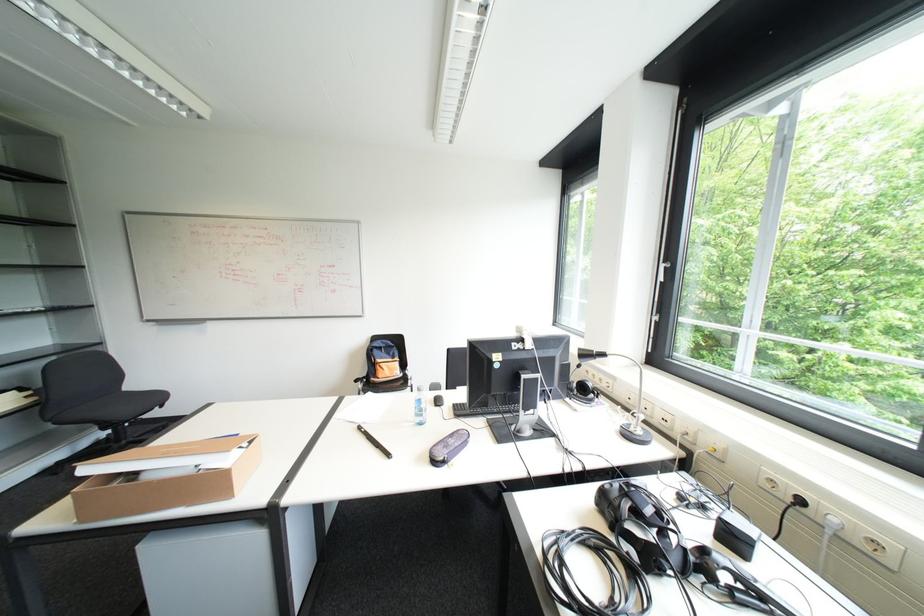
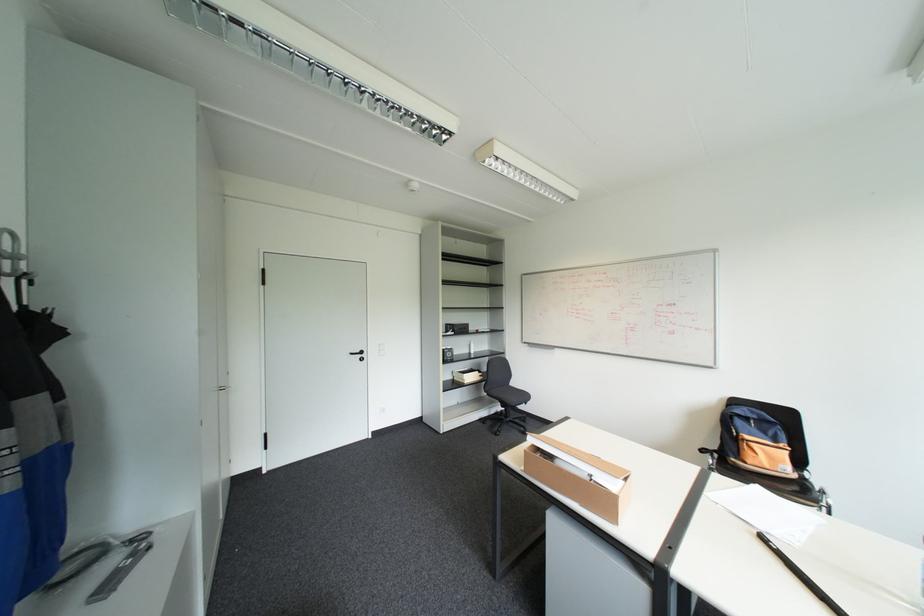
Question: The first image is from the beginning of the video and the second image is from the end. How did the camera likely rotate when shooting the video?

Choices:
 (A) Left
 (B) Right
 (C) Up
 (D) Down

Answer: (A)